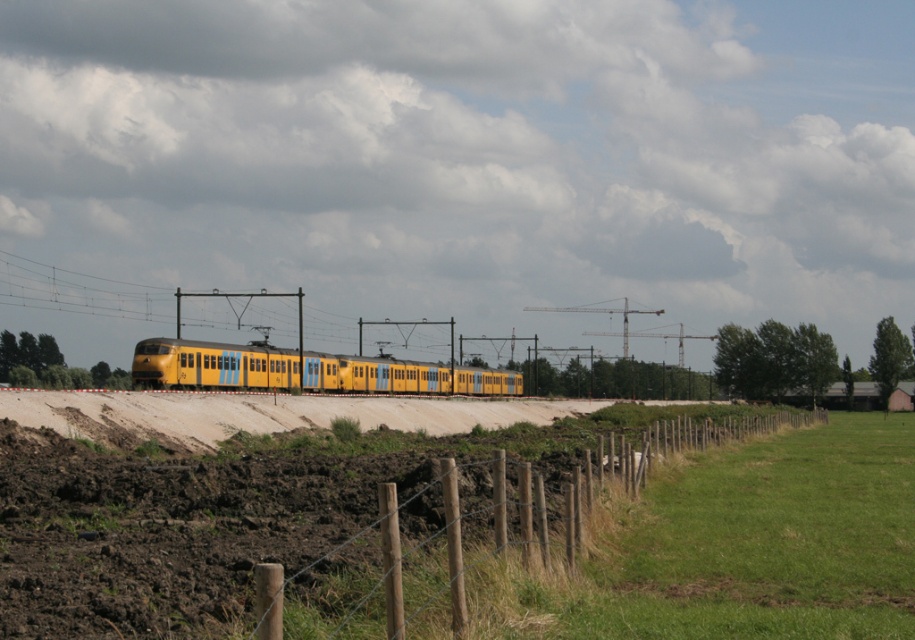
You are a farmer standing in the fenced area looking at the green grass at lower right and the yellow matte train at center. Which area is smaller in size?

The green grass at lower right occupies less space than the yellow matte train at center, so the green grass at lower right is smaller in size.

You are standing at the point marked by the coordinate point at lower right. Looking towards the yellow train traveling along the railway track, which direction should you turn to face the yellow train? The point is marked as point (x=768, y=541). Please answer with the direction as left, right, forward, or backward.

The point (x=768, y=541) marks green grass at lower right. Since the yellow train is moving from left to right across the frame, you should turn to your left to face the direction of the yellow train.